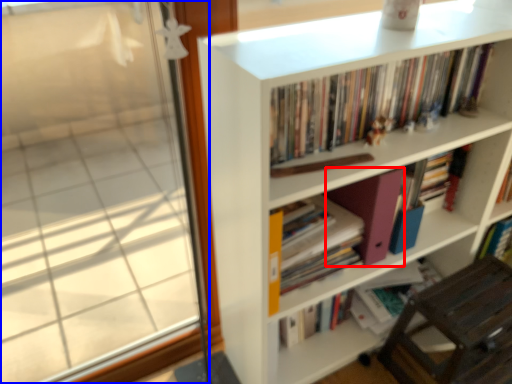
Question: Which object appears closest to the camera in this image, paperback book (highlighted by a red box) or window (highlighted by a blue box)?

Choices:
 (A) paperback book
 (B) window

Answer: (B)